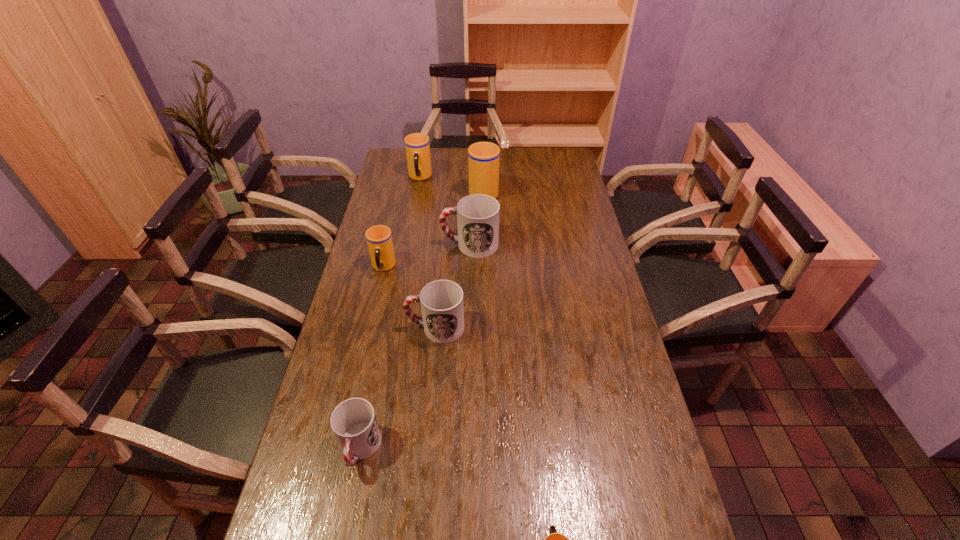
Where is `the tallest object`? the tallest object is located at coordinates (483, 157).

Where is `the tallest cup`? The height and width of the screenshot is (540, 960). the tallest cup is located at coordinates (483, 157).

Find the location of `the second biggest beige cup`. the second biggest beige cup is located at coordinates (417, 146).

Find the location of `the biggest red cup`. the biggest red cup is located at coordinates (477, 215).

This screenshot has width=960, height=540. I want to click on the fifth farthest object, so click(x=442, y=307).

Image resolution: width=960 pixels, height=540 pixels. Find the location of `the second smallest red cup`. the second smallest red cup is located at coordinates (442, 307).

Identify the location of the second smallest beige cup. The height and width of the screenshot is (540, 960). (379, 239).

This screenshot has width=960, height=540. In order to click on the leftmost red cup in this screenshot , I will do `click(354, 423)`.

Locate an element on the screen. the sixth farthest object is located at coordinates (354, 423).

Locate an element on the screen. The image size is (960, 540). vacant space situated 0.250m on the side of the tallest cup with the handle is located at coordinates (483, 153).